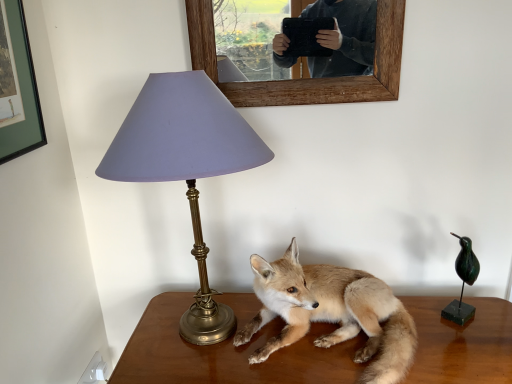
Question: Is brown wooden table at center bigger than furry golden fox at center?

Choices:
 (A) no
 (B) yes

Answer: (B)

Question: Considering the relative sizes of brown wooden table at center and furry golden fox at center in the image provided, is brown wooden table at center shorter than furry golden fox at center?

Choices:
 (A) no
 (B) yes

Answer: (A)

Question: Is brown wooden table at center taller than furry golden fox at center?

Choices:
 (A) yes
 (B) no

Answer: (A)

Question: Is furry golden fox at center at the back of brown wooden table at center?

Choices:
 (A) no
 (B) yes

Answer: (A)

Question: Is brown wooden table at center at the right side of furry golden fox at center?

Choices:
 (A) yes
 (B) no

Answer: (A)

Question: Considering the positions of point (322, 291) and point (131, 152), is point (322, 291) closer or farther from the camera than point (131, 152)?

Choices:
 (A) farther
 (B) closer

Answer: (A)

Question: From a real-world perspective, is furry golden fox at center positioned above or below matte purple shade at left?

Choices:
 (A) above
 (B) below

Answer: (B)

Question: From the image's perspective, is furry golden fox at center positioned above or below matte purple shade at left?

Choices:
 (A) below
 (B) above

Answer: (A)

Question: In the image, is furry golden fox at center on the left side or the right side of matte purple shade at left?

Choices:
 (A) right
 (B) left

Answer: (A)

Question: Is point (215, 54) closer or farther from the camera than point (312, 311)?

Choices:
 (A) farther
 (B) closer

Answer: (B)

Question: From the image's perspective, is wooden picture frame at upper center above or below furry golden fox at center?

Choices:
 (A) below
 (B) above

Answer: (B)

Question: Is wooden picture frame at upper center taller or shorter than furry golden fox at center?

Choices:
 (A) short
 (B) tall

Answer: (B)

Question: From a real-world perspective, is wooden picture frame at upper center above or below furry golden fox at center?

Choices:
 (A) below
 (B) above

Answer: (B)

Question: In terms of height, does wooden picture frame at upper center look taller or shorter compared to brown wooden table at center?

Choices:
 (A) tall
 (B) short

Answer: (B)

Question: Choose the correct answer: Is wooden picture frame at upper center inside brown wooden table at center or outside it?

Choices:
 (A) inside
 (B) outside

Answer: (B)